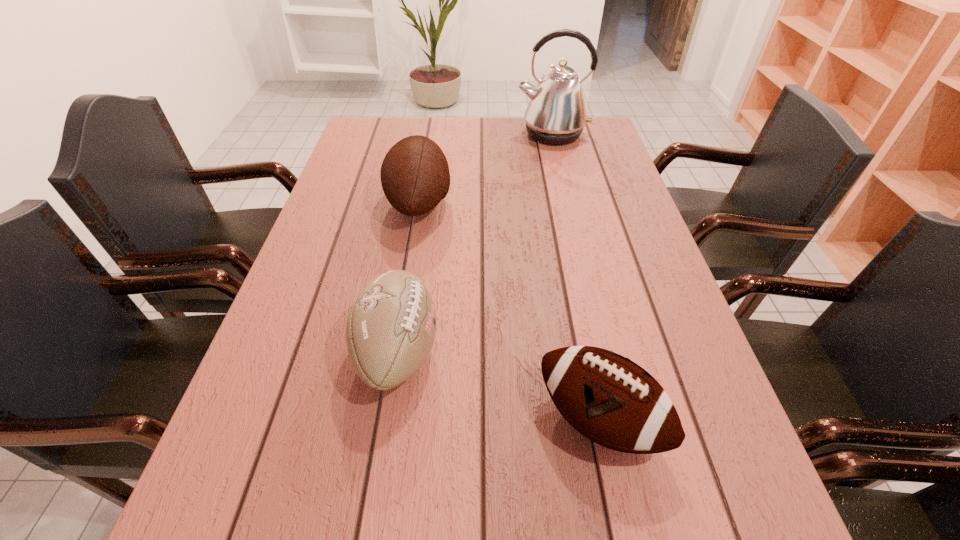
Identify the location of vacant space that satisfies the following two spatial constraints: 1. on the laces of the second farthest object; 2. on the right side of the rightmost football (American). This screenshot has width=960, height=540. (383, 420).

Image resolution: width=960 pixels, height=540 pixels. Find the location of `free region that satisfies the following two spatial constraints: 1. from the spout of the farthest object; 2. on the laces of the farthest football (American)`. free region that satisfies the following two spatial constraints: 1. from the spout of the farthest object; 2. on the laces of the farthest football (American) is located at coordinates (568, 203).

I want to click on free space that satisfies the following two spatial constraints: 1. on the laces of the rightmost football (American); 2. on the right side of the second farthest object, so click(x=383, y=420).

You are a GUI agent. You are given a task and a screenshot of the screen. Output one action in this format:
    pyautogui.click(x=<x>, y=<y>)
    Task: Click on the free spot that satisfies the following two spatial constraints: 1. on the laces of the second farthest object; 2. on the left side of the rightmost football (American)
    The height and width of the screenshot is (540, 960).
    Given the screenshot: What is the action you would take?
    pyautogui.click(x=383, y=420)